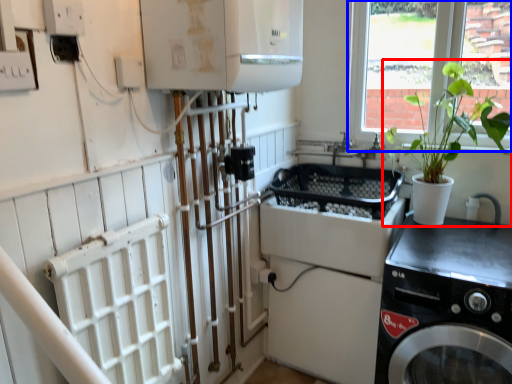
Question: Which object appears farthest to the camera in this image, houseplant (highlighted by a red box) or window (highlighted by a blue box)?

Choices:
 (A) houseplant
 (B) window

Answer: (B)